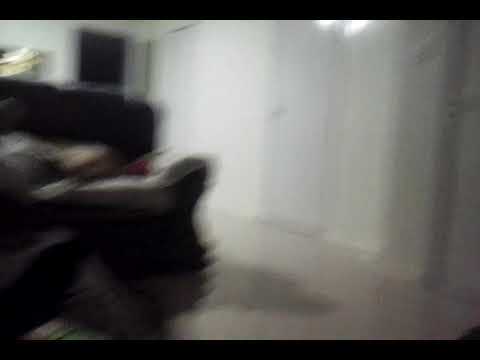
The image size is (480, 360). Identify the location of white door. (295, 102).